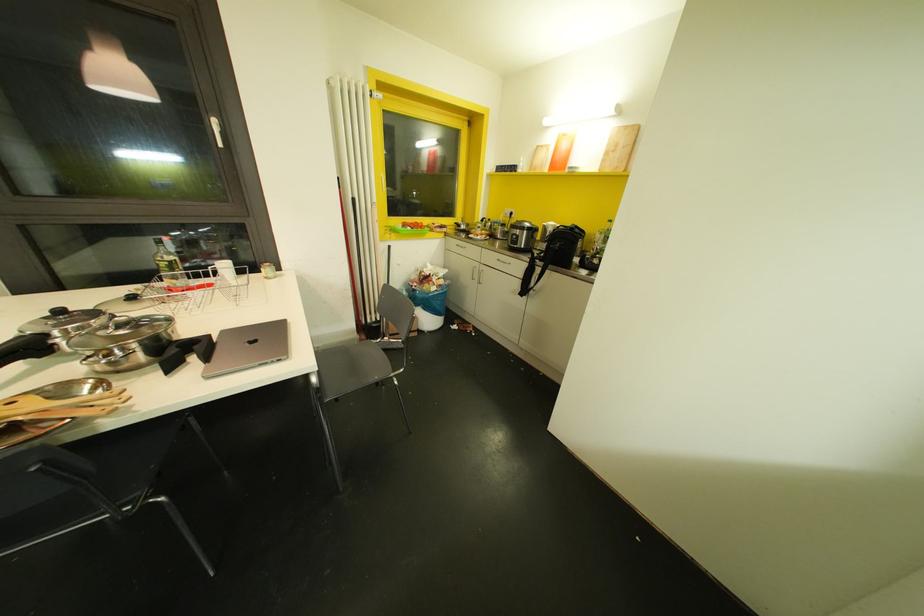
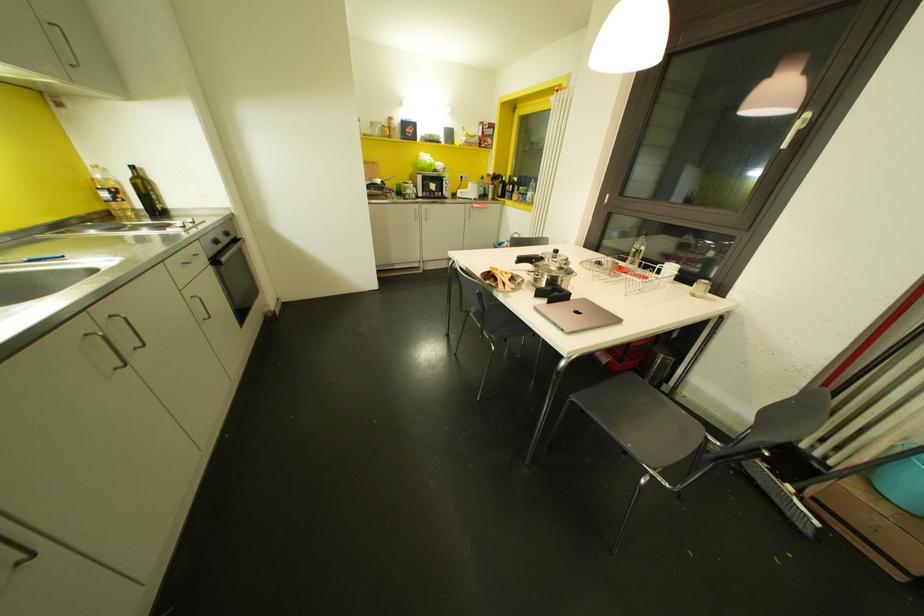
Based on the continuous images, in which direction is the camera rotating?

The camera rotated toward left-down.